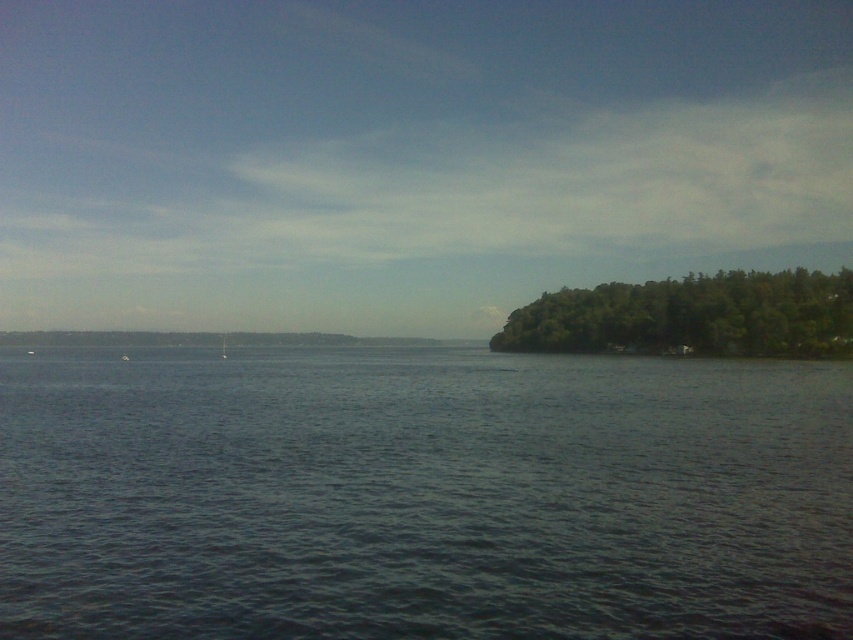
In the scene shown: Does green leafy trees at right come behind white matte boat at center?

No.

Is point (711, 339) positioned after point (122, 358)?

That is False.

Who is more distant from viewer, (844,292) or (126,358)?

The point (126,358) is behind.

Locate an element on the screen. green leafy trees at right is located at coordinates (692, 316).

Is dark blue water at center shorter than white matte boat at center?

Incorrect, dark blue water at center's height does not fall short of white matte boat at center's.

Between dark blue water at center and white matte boat at center, which one has less height?

Standing shorter between the two is white matte boat at center.

Between point (442, 624) and point (125, 355), which one is positioned in front?

Point (442, 624)

The width and height of the screenshot is (853, 640). I want to click on dark blue water at center, so click(x=422, y=497).

Does point (608, 547) come behind point (727, 333)?

No, (608, 547) is closer to viewer.

Who is lower down, dark blue water at center or green leafy trees at right?

dark blue water at center is below.

Between point (80, 360) and point (728, 307), which one is positioned behind?

The point (728, 307) is more distant.

This screenshot has width=853, height=640. I want to click on dark blue water at center, so click(422, 497).